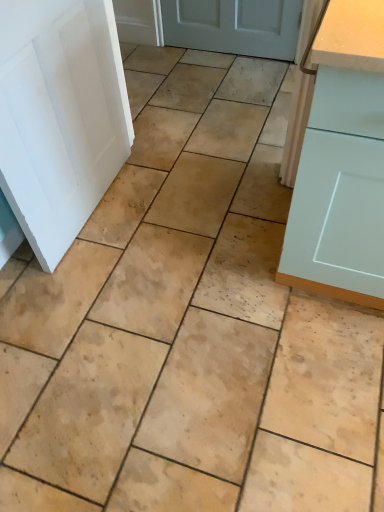
Question: Does point (334, 72) appear closer or farther from the camera than point (44, 133)?

Choices:
 (A) closer
 (B) farther

Answer: (A)

Question: Is light blue matte cabinet at right to the left or to the right of white matte door at left in the image?

Choices:
 (A) left
 (B) right

Answer: (B)

Question: Is light blue matte cabinet at right in front of or behind white matte door at left in the image?

Choices:
 (A) behind
 (B) front

Answer: (B)

Question: Considering the positions of white matte door at left and light blue matte cabinet at right in the image, is white matte door at left wider or thinner than light blue matte cabinet at right?

Choices:
 (A) wide
 (B) thin

Answer: (B)

Question: Is white matte door at left taller or shorter than light blue matte cabinet at right?

Choices:
 (A) tall
 (B) short

Answer: (B)

Question: Does point (34, 197) appear closer or farther from the camera than point (377, 18)?

Choices:
 (A) farther
 (B) closer

Answer: (A)

Question: Is white matte door at left spatially inside light blue matte cabinet at right, or outside of it?

Choices:
 (A) outside
 (B) inside

Answer: (A)